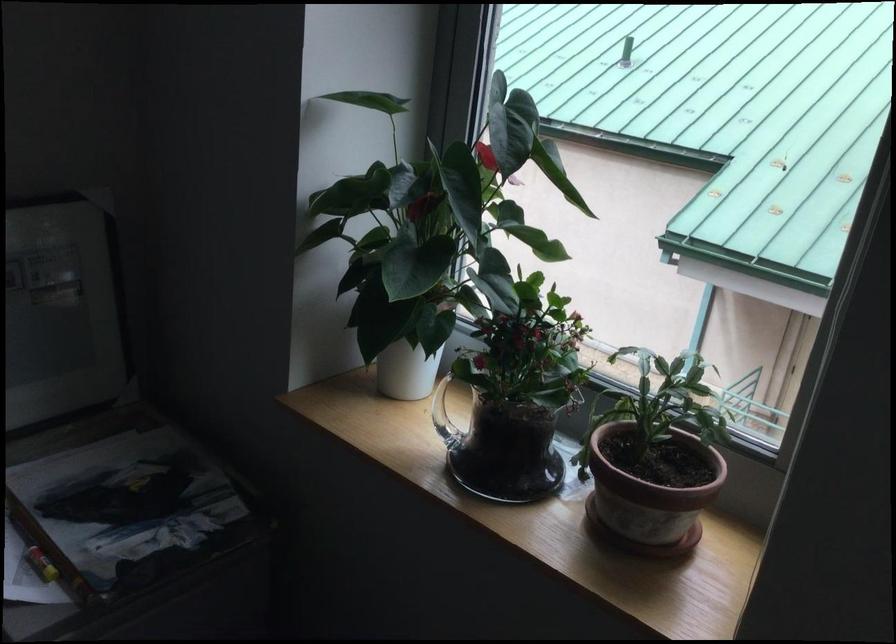
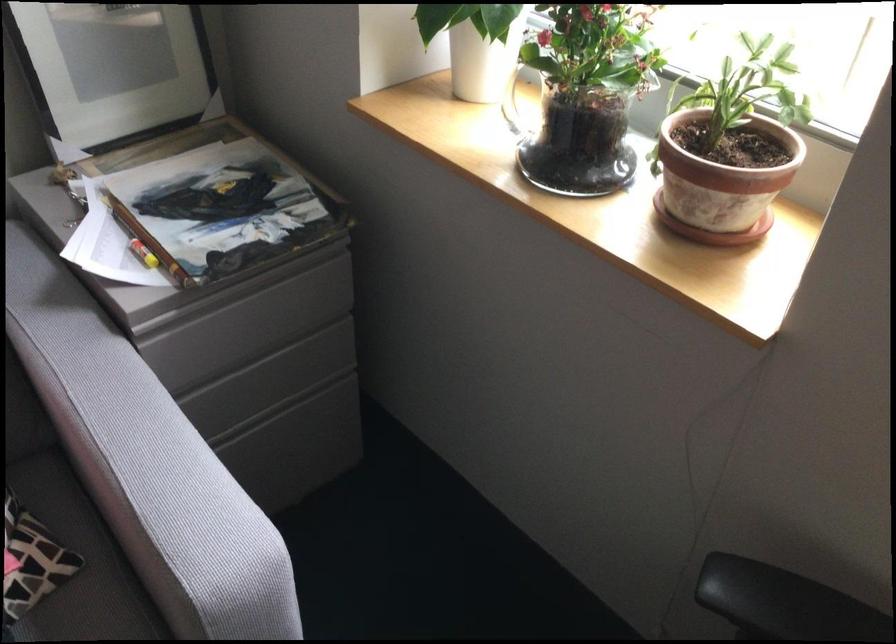
The point at (x=393, y=351) is marked in the first image. Where is the corresponding point in the second image?

(467, 44)